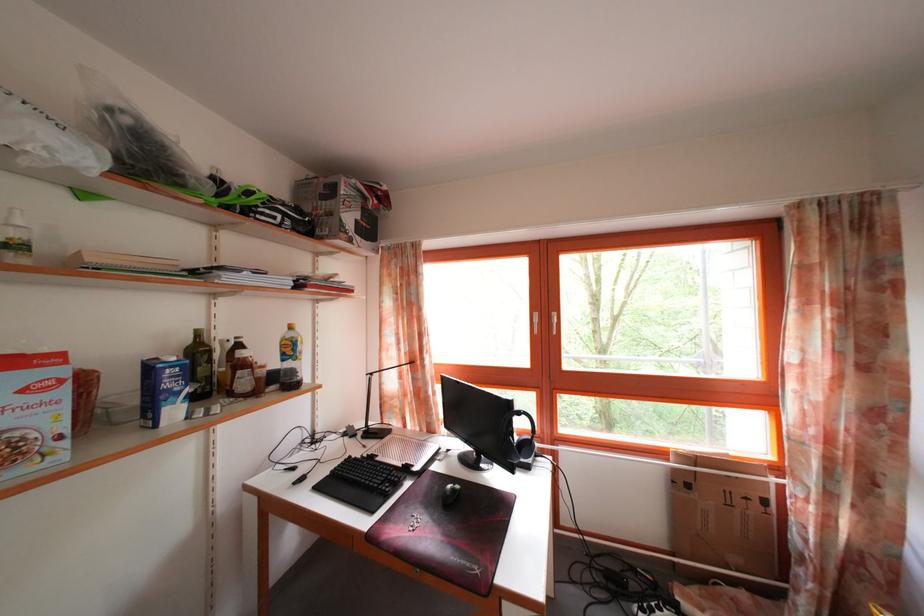
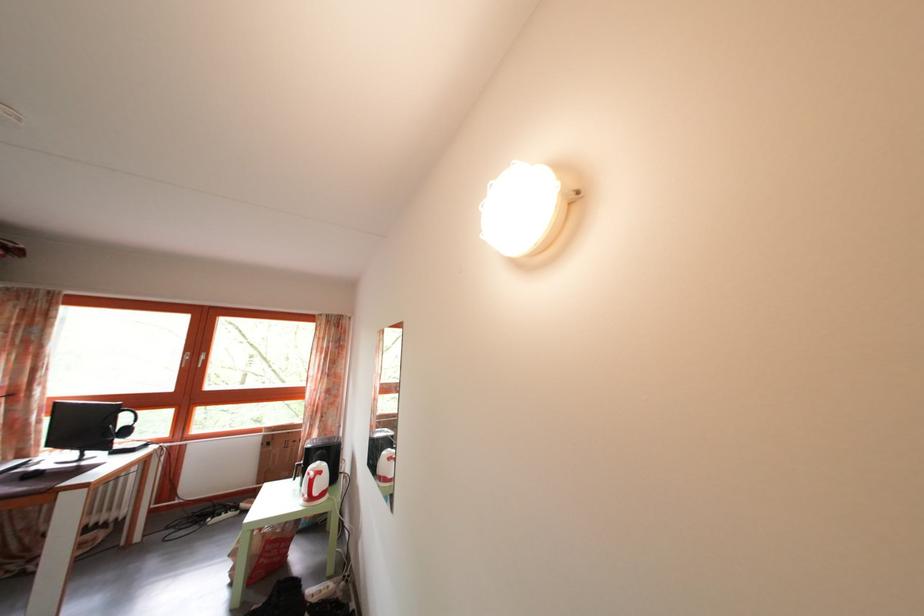
In the second image, find the point that corresponds to point (834, 524) in the first image.

(317, 442)